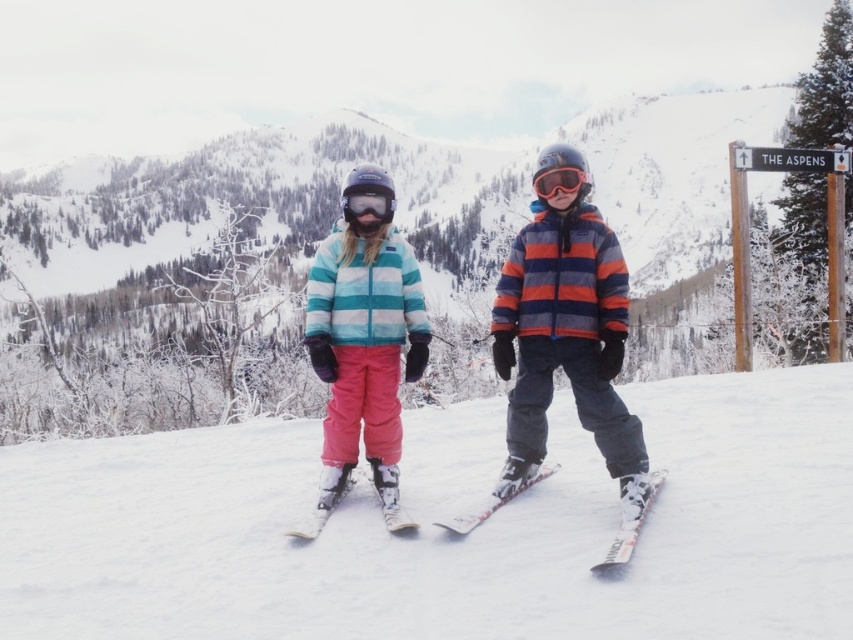
You are a drone operator trying to capture a photo of two children on a snowy slope. The children are located at point (613, 548). Your drone has a camera with a maximum range of 25 meters. Can you take a clear photo of them from your current position?

The children are 28.78 meters away from your current position, which exceeds the drone camera maximum range of 25 meters. You cannot take a clear photo of them from here.

You are a photographer trying to capture a photo of both the pink fabric pants at center and the matte blue striped jacket at center. Which object should you focus on first to ensure both are in sharp focus?

You should focus on the pink fabric pants at center first because it is closer to the viewer than the matte blue striped jacket at center. By focusing on the closer object, the farther one will also be in focus due to the depth of field.